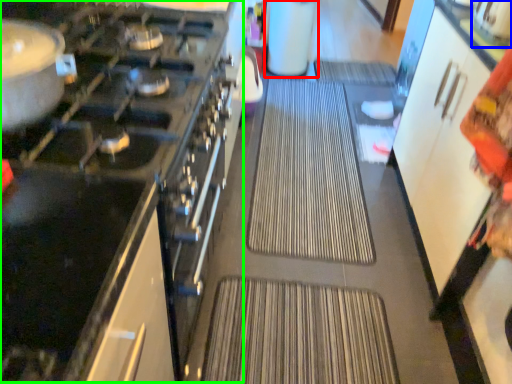
Question: Which object is positioned farthest from appliance (highlighted by a red box)? Select from appliance (highlighted by a blue box) and appliance (highlighted by a green box).

Choices:
 (A) appliance
 (B) appliance

Answer: (B)